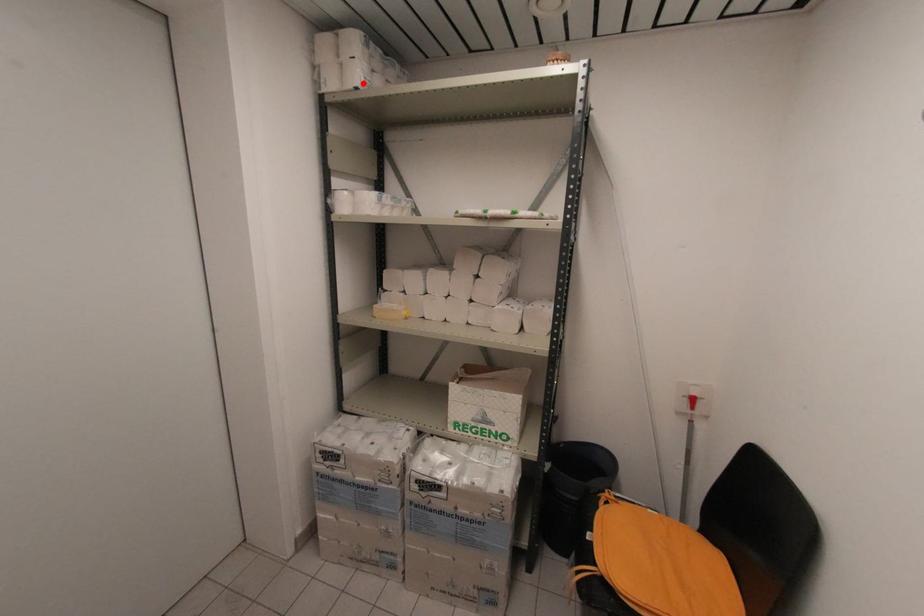
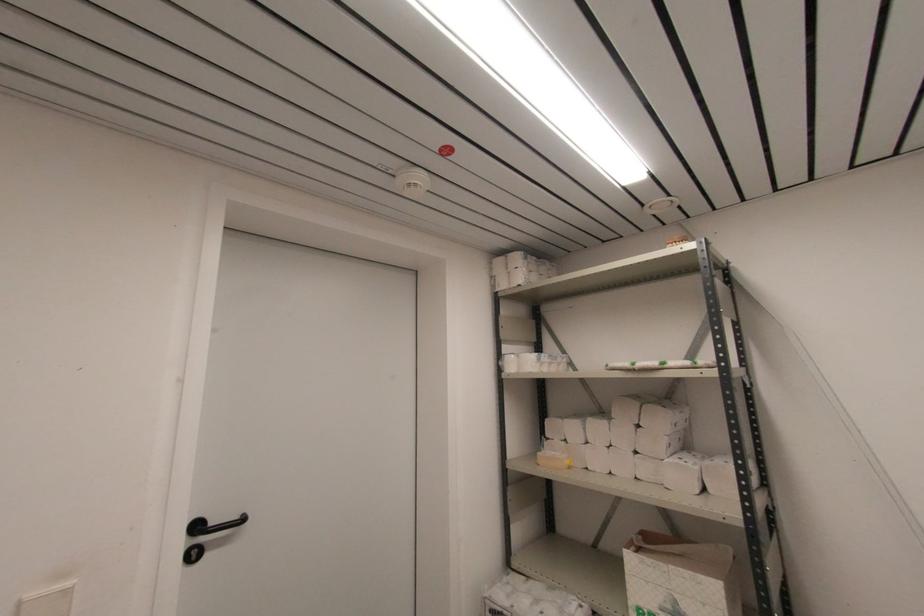
Question: I am providing you with two images of the same scene from different viewpoints. Image1 has a red point marked. In image2, the corresponding 3D location appears at what relative position? Reply with the corresponding letter.

Choices:
 (A) Closer
 (B) Farther

Answer: (A)